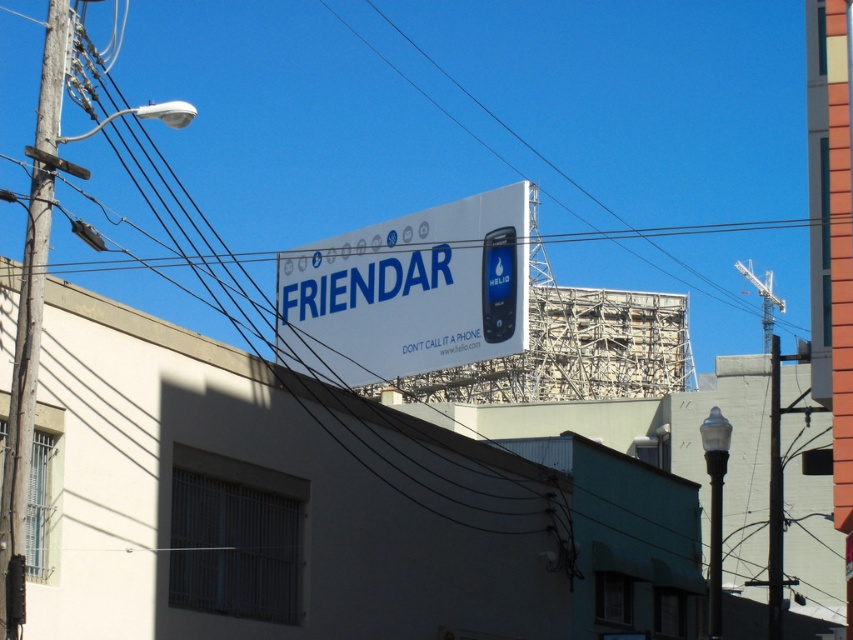
You are a city planner assessing the billboard installation. The black wire at upper center and the white matte signboard at center are part of the structure. Based on the scene, which object could potentially block the view of the billboard more significantly?

The black wire at upper center might block the view more significantly since it could be wider than the white matte signboard at center.

You are a city planner assessing the billboard installation. You notice the black wire at upper center and the wooden utility pole at left. Which object is positioned higher in the scene?

The black wire at upper center is located above the wooden utility pole at left, so it is positioned higher in the scene.

You are a delivery person who needs to deliver a package to the white matte signboard at center. The delivery robot you are using has a maximum turning radius of 1.2 meters. The path to the signboard requires a turn at point (x=408, y=292). Can your robot navigate this turn?

The white matte signboard at center is located at point (x=408, y=292). Since the robot has a maximum turning radius of 1.2 meters, it can navigate the turn at that point as long as the path allows for a turn within that radius.